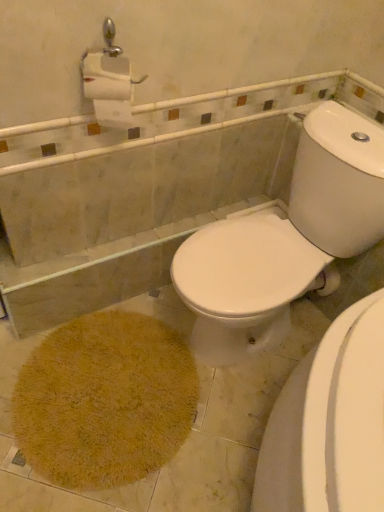
Question: Does white glossy toilet at center have a greater height compared to yellow shaggy bath mat at lower left?

Choices:
 (A) no
 (B) yes

Answer: (B)

Question: Considering the relative sizes of white glossy toilet at center and yellow shaggy bath mat at lower left in the image provided, is white glossy toilet at center wider than yellow shaggy bath mat at lower left?

Choices:
 (A) no
 (B) yes

Answer: (B)

Question: From a real-world perspective, is white glossy toilet at center on yellow shaggy bath mat at lower left?

Choices:
 (A) yes
 (B) no

Answer: (A)

Question: Considering the relative sizes of white glossy toilet at center and yellow shaggy bath mat at lower left in the image provided, is white glossy toilet at center bigger than yellow shaggy bath mat at lower left?

Choices:
 (A) yes
 (B) no

Answer: (A)

Question: Is white glossy toilet at center thinner than yellow shaggy bath mat at lower left?

Choices:
 (A) yes
 (B) no

Answer: (B)

Question: From the image's perspective, is white glossy toilet at center above yellow shaggy bath mat at lower left?

Choices:
 (A) yes
 (B) no

Answer: (A)

Question: Is yellow shaggy bath mat at lower left touching white glossy toilet at center?

Choices:
 (A) yes
 (B) no

Answer: (B)

Question: From a real-world perspective, is yellow shaggy bath mat at lower left located beneath white glossy toilet at center?

Choices:
 (A) no
 (B) yes

Answer: (B)

Question: Is yellow shaggy bath mat at lower left closer to the viewer compared to white glossy toilet at center?

Choices:
 (A) yes
 (B) no

Answer: (B)

Question: Is yellow shaggy bath mat at lower left oriented towards white glossy toilet at center?

Choices:
 (A) yes
 (B) no

Answer: (B)

Question: Considering the relative sizes of yellow shaggy bath mat at lower left and white glossy toilet at center in the image provided, is yellow shaggy bath mat at lower left thinner than white glossy toilet at center?

Choices:
 (A) no
 (B) yes

Answer: (B)

Question: Is yellow shaggy bath mat at lower left far from white glossy toilet at center?

Choices:
 (A) no
 (B) yes

Answer: (A)

Question: From the image's perspective, is yellow shaggy bath mat at lower left above or below white glossy toilet at center?

Choices:
 (A) below
 (B) above

Answer: (A)